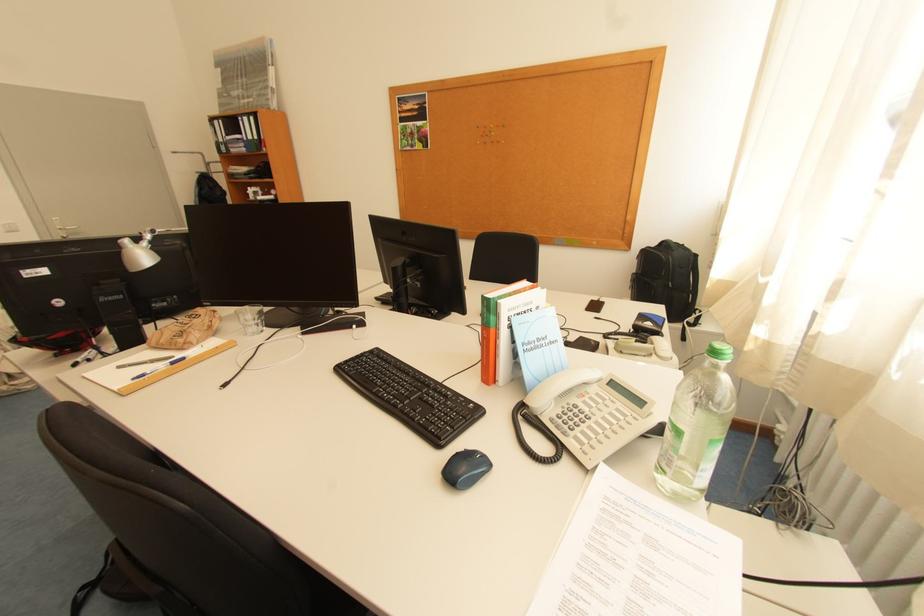
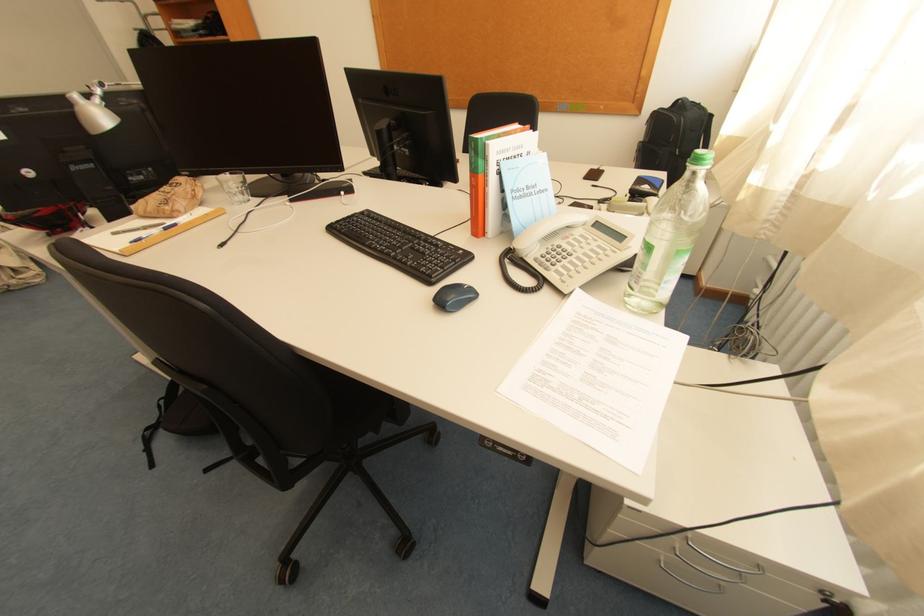
The point at [166,349] is marked in the first image. Where is the corresponding point in the second image?

(155, 217)